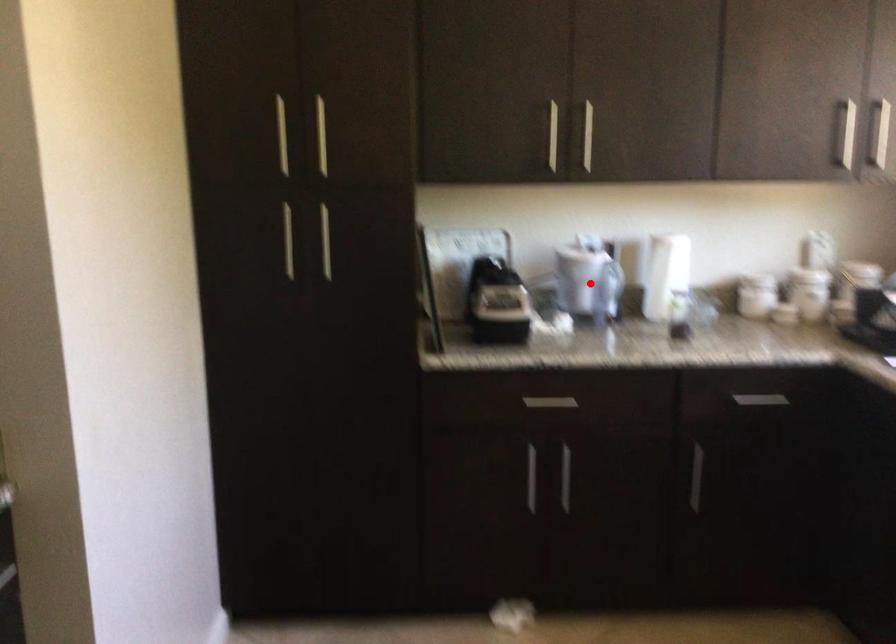
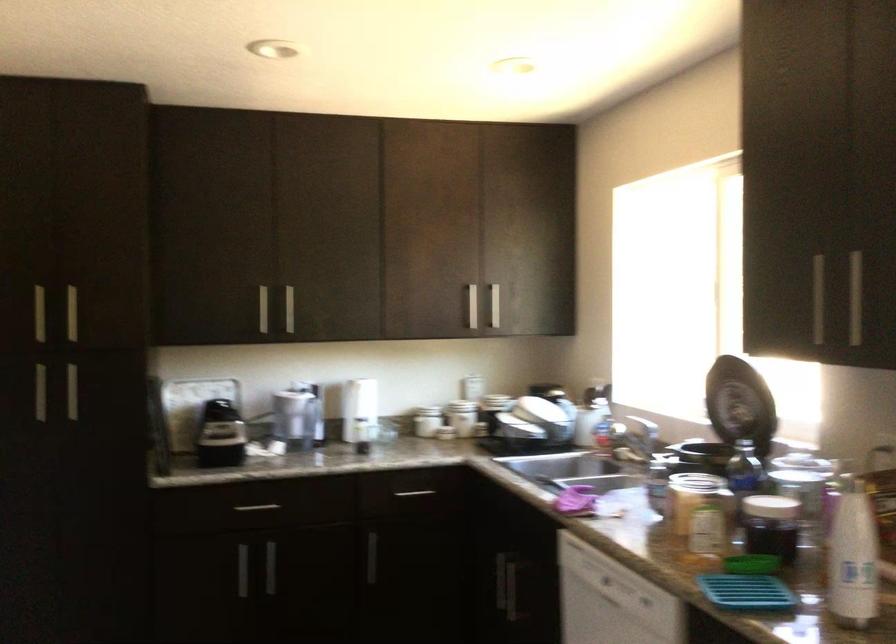
Question: I am providing you with two images of the same scene from different viewpoints. A red point is marked on the first image. Is the red point's position out of view in image 2?

Choices:
 (A) Yes
 (B) No

Answer: (B)